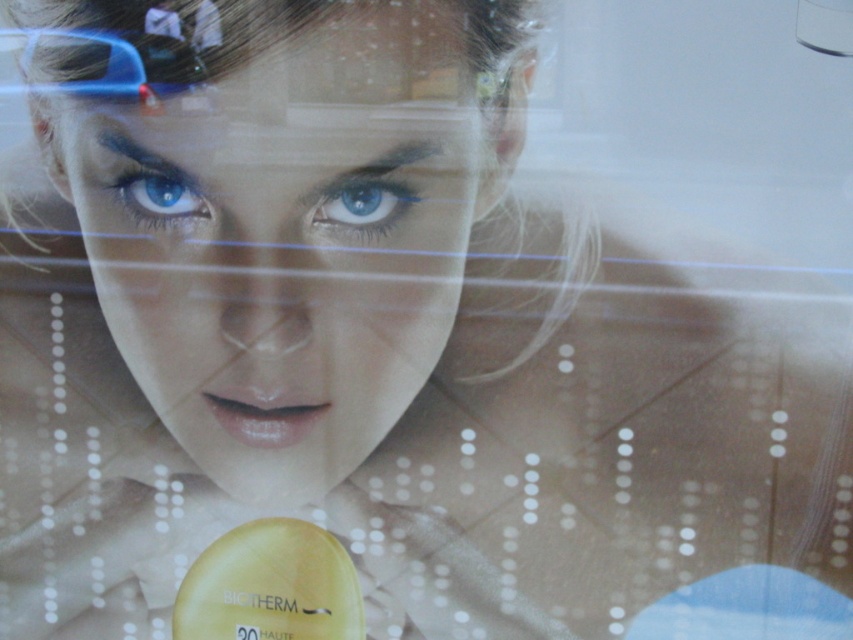
Question: Is blue matte eye at center further to the viewer compared to blue matte eye at upper left?

Choices:
 (A) yes
 (B) no

Answer: (B)

Question: Estimate the real-world distances between objects in this image. Which object is closer to the blue matte eye at upper left?

Choices:
 (A) blue matte eye at center
 (B) smooth skin face at center

Answer: (B)

Question: Which of these objects is positioned closest to the smooth skin face at center?

Choices:
 (A) blue matte eye at center
 (B) blue matte eye at upper left

Answer: (A)

Question: Does smooth skin face at center appear over blue matte eye at center?

Choices:
 (A) yes
 (B) no

Answer: (B)

Question: Is blue matte eye at center above blue matte eye at upper left?

Choices:
 (A) no
 (B) yes

Answer: (A)

Question: Which is farther from the blue matte eye at center?

Choices:
 (A) smooth skin face at center
 (B) blue matte eye at upper left

Answer: (B)